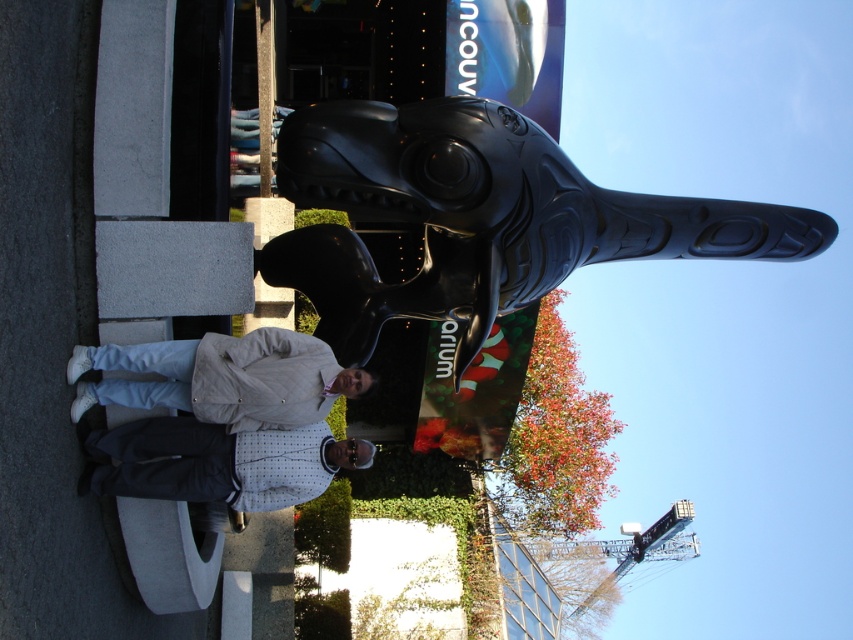
Question: Is black polished whale at center to the left of white dotted fabric at center from the viewer's perspective?

Choices:
 (A) no
 (B) yes

Answer: (A)

Question: Which point is closer to the camera?

Choices:
 (A) (215, 484)
 (B) (670, 234)

Answer: (A)

Question: Does black polished whale at center have a greater width compared to beige fabric jacket at lower center?

Choices:
 (A) yes
 (B) no

Answer: (A)

Question: Which object appears farthest from the camera in this image?

Choices:
 (A) black polished whale at center
 (B) beige fabric jacket at lower center
 (C) white dotted fabric at center

Answer: (A)

Question: Which of these objects is positioned closest to the black polished whale at center?

Choices:
 (A) white dotted fabric at center
 (B) beige fabric jacket at lower center

Answer: (B)

Question: Is black polished whale at center bigger than white dotted fabric at center?

Choices:
 (A) yes
 (B) no

Answer: (A)